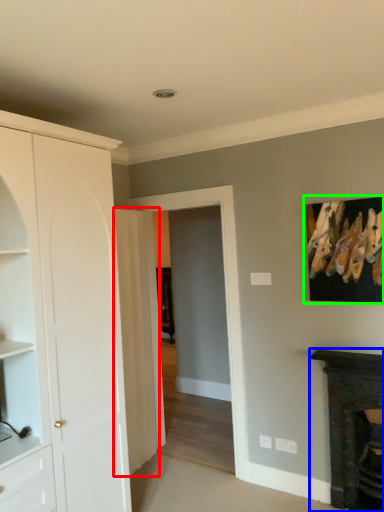
Question: Considering the real-world distances, which object is closest to door (highlighted by a red box)? fireplace (highlighted by a blue box) or picture frame (highlighted by a green box).

Choices:
 (A) fireplace
 (B) picture frame

Answer: (A)